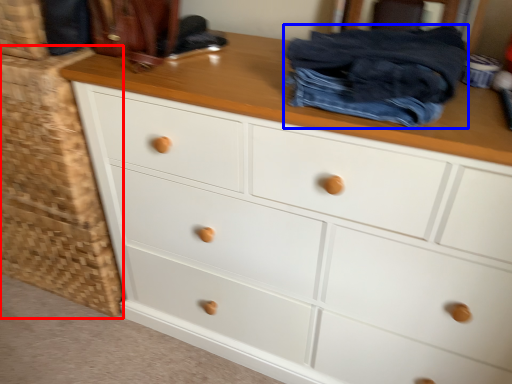
Question: Which of the following is the farthest to the observer, cabinetry (highlighted by a red box) or clothing (highlighted by a blue box)?

Choices:
 (A) cabinetry
 (B) clothing

Answer: (A)